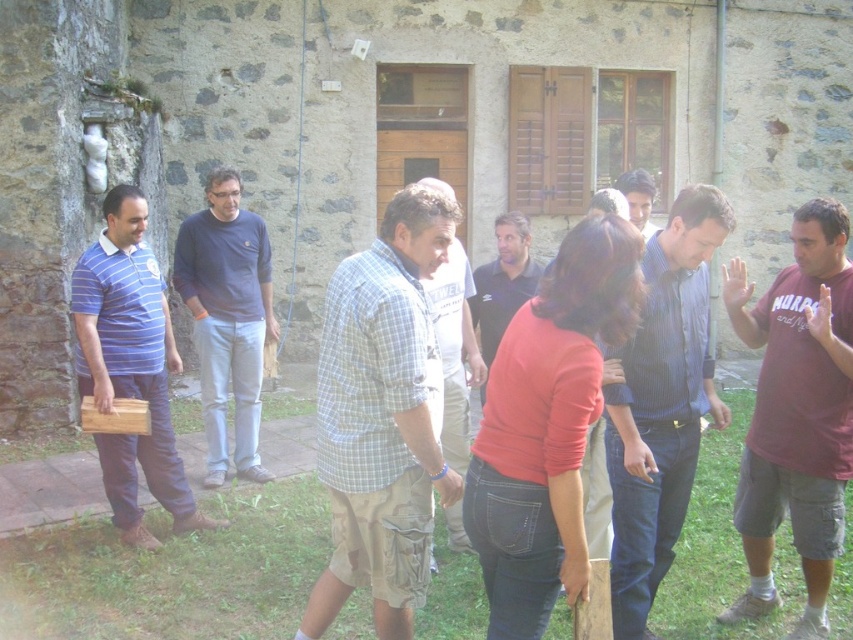
You are trying to identify the order of two people in the crowd based on their clothing. Which person is closer to you, the checkered fabric shirt at center or the matte blue shirt at center?

The checkered fabric shirt at center is in front of the matte blue shirt at center, so the checkered fabric shirt at center is closer to you.

You are a photographer standing 10 feet away from the two people wearing the checkered fabric shirt at center and the matte blue shirt at center. You want to take a photo that captures both of them in the frame without any part of their shirts being cut off. Given that your camera has a maximum field of view of 15 inches, can you do this?

The checkered fabric shirt at center and matte blue shirt at center are 16.08 inches apart from each other. Since the distance between them exceeds the camera field of view of 15 inches, you cannot capture both shirts in the frame without cutting off parts of them.

You are standing in front of the stone building and want to greet the person in the smooth brown shirt at center. Which direction should you move to face the blue striped shirt at center?

The blue striped shirt at center is to the left of the smooth brown shirt at center, so you should move to your left to face the blue striped shirt at center.